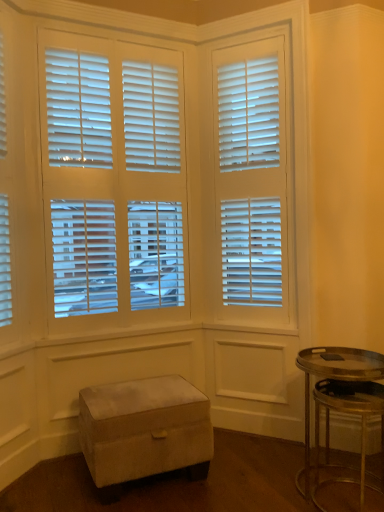
Question: Is point (334, 347) closer or farther from the camera than point (97, 437)?

Choices:
 (A) farther
 (B) closer

Answer: (A)

Question: Is metallic gold table at lower right inside or outside of suede ottoman at lower left?

Choices:
 (A) outside
 (B) inside

Answer: (A)

Question: From their relative heights in the image, would you say metallic gold table at lower right is taller or shorter than suede ottoman at lower left?

Choices:
 (A) short
 (B) tall

Answer: (B)

Question: From the image's perspective, is suede ottoman at lower left above or below metallic gold table at lower right?

Choices:
 (A) above
 (B) below

Answer: (B)

Question: In the image, is suede ottoman at lower left positioned in front of or behind metallic gold table at lower right?

Choices:
 (A) front
 (B) behind

Answer: (B)

Question: Would you say suede ottoman at lower left is to the left or to the right of metallic gold table at lower right in the picture?

Choices:
 (A) right
 (B) left

Answer: (B)

Question: From a real-world perspective, relative to metallic gold table at lower right, is suede ottoman at lower left vertically above or below?

Choices:
 (A) above
 (B) below

Answer: (B)